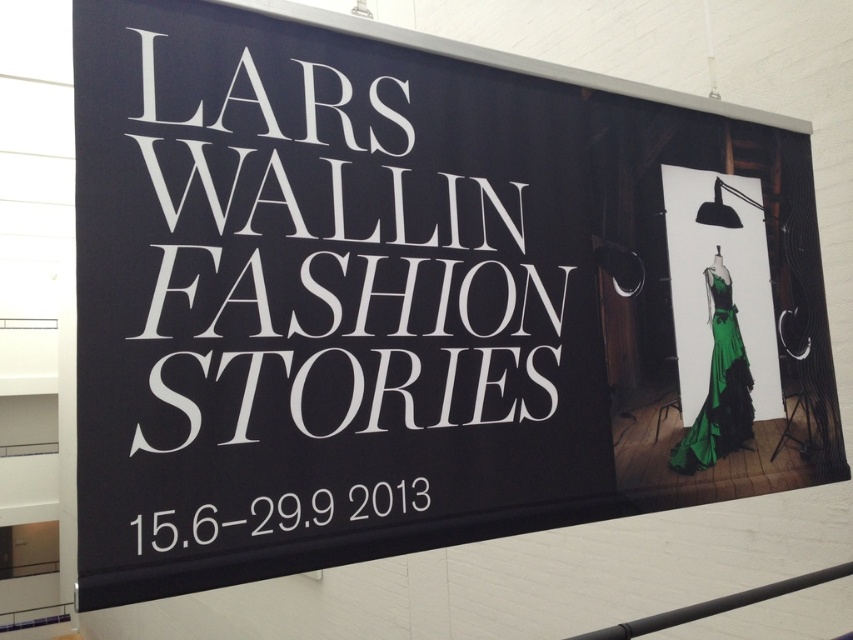
You are an event planner standing in front of the banner and need to adjust the lighting. Since you want to highlight both the white text at center and the green satin dress at right, which object should you focus the light on first based on their positions?

The white text at center is in front of the green satin dress at right, so you should focus the light on the white text at center first to ensure it is properly illuminated before adjusting the lighting for the green satin dress at right.

You are a visitor standing in front of the promotional banner. You want to read the text first before looking at the dress. Which object should you look at first, the white text at center or the green satin dress at right?

The white text at center is positioned on the left side of the green satin dress at right. Since you want to read the text first, you should look at the white text at center first before looking at the green satin dress at right.

You are standing in front of the promotional banner. There is a point at coordinates [283,515]. What is located at this point on the banner?

The point at coordinates [283,515] corresponds to the white text at center, which is part of the banner displaying the event details.